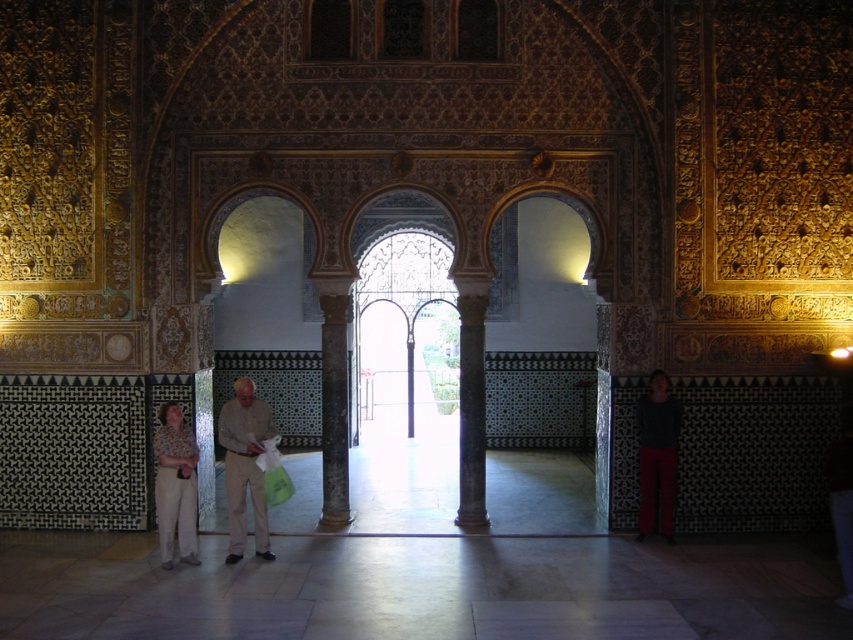
Does dark gray sweater at right have a greater width compared to metallic silver pillar at center?

Correct, the width of dark gray sweater at right exceeds that of metallic silver pillar at center.

Based on the photo, is dark gray sweater at right above metallic silver pillar at center?

Incorrect, dark gray sweater at right is not positioned above metallic silver pillar at center.

At what (x,y) coordinates should I click in order to perform the action: click on dark gray sweater at right. Please return your answer as a coordinate pair (x, y). Looking at the image, I should click on (657, 456).

Locate an element on the screen. This screenshot has height=640, width=853. dark gray sweater at right is located at coordinates click(x=657, y=456).

Can you confirm if black marble column at center is thinner than dark gray sweater at right?

Indeed, black marble column at center has a lesser width compared to dark gray sweater at right.

Which is behind, point (483, 296) or point (653, 381)?

The point (483, 296) is more distant.

I want to click on black marble column at center, so click(471, 412).

Is dark gray stone column at center closer to camera compared to black marble column at center?

No, it is not.

Consider the image. Does dark gray stone column at center have a lesser height compared to black marble column at center?

In fact, dark gray stone column at center may be taller than black marble column at center.

Consider the image. Who is more distant from viewer, (x=329, y=419) or (x=480, y=310)?

Point (x=329, y=419)

Locate an element on the screen. The height and width of the screenshot is (640, 853). dark gray stone column at center is located at coordinates (334, 408).